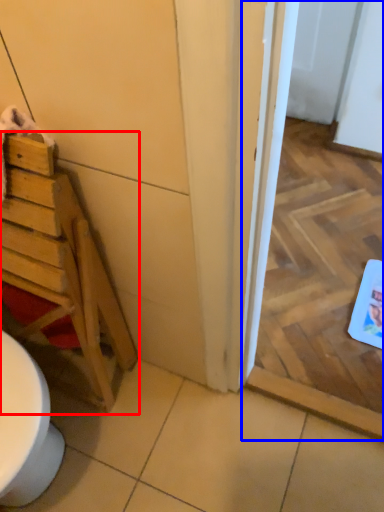
Question: Among these objects, which one is nearest to the camera, furniture (highlighted by a red box) or screen door (highlighted by a blue box)?

Choices:
 (A) furniture
 (B) screen door

Answer: (A)